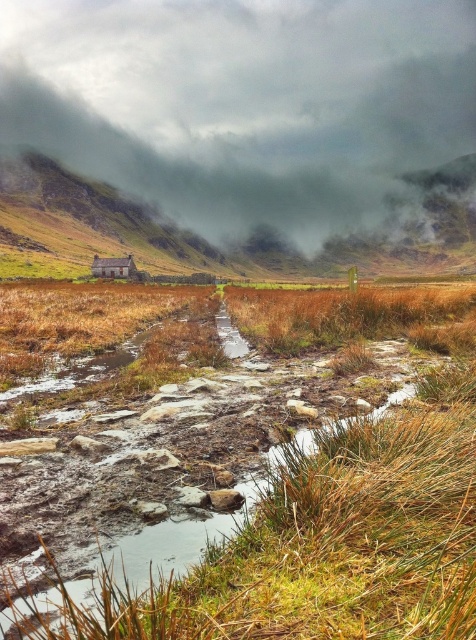
Is point (287, 257) less distant than point (122, 262)?

No, it is not.

Between brown grassy hillside at center and brown wooden hut at center, which one is positioned lower?

Positioned lower is brown wooden hut at center.

Where is `brown grassy hillside at center`? This screenshot has width=476, height=640. brown grassy hillside at center is located at coordinates (206, 240).

Does gray foggy cloud at upper center have a larger size compared to brown wooden hut at center?

Correct, gray foggy cloud at upper center is larger in size than brown wooden hut at center.

Is gray foggy cloud at upper center thinner than brown wooden hut at center?

Incorrect, gray foggy cloud at upper center's width is not less than brown wooden hut at center's.

You are a GUI agent. You are given a task and a screenshot of the screen. Output one action in this format:
    pyautogui.click(x=<x>, y=<y>)
    Task: Click on the gray foggy cloud at upper center
    The width and height of the screenshot is (476, 640).
    Given the screenshot: What is the action you would take?
    pyautogui.click(x=244, y=104)

Image resolution: width=476 pixels, height=640 pixels. I want to click on gray foggy cloud at upper center, so click(244, 104).

The width and height of the screenshot is (476, 640). What do you see at coordinates (244, 104) in the screenshot?
I see `gray foggy cloud at upper center` at bounding box center [244, 104].

Who is more forward, (159, 86) or (136, 240)?

Point (136, 240) is in front.

Where is `gray foggy cloud at upper center`? This screenshot has height=640, width=476. gray foggy cloud at upper center is located at coordinates (244, 104).